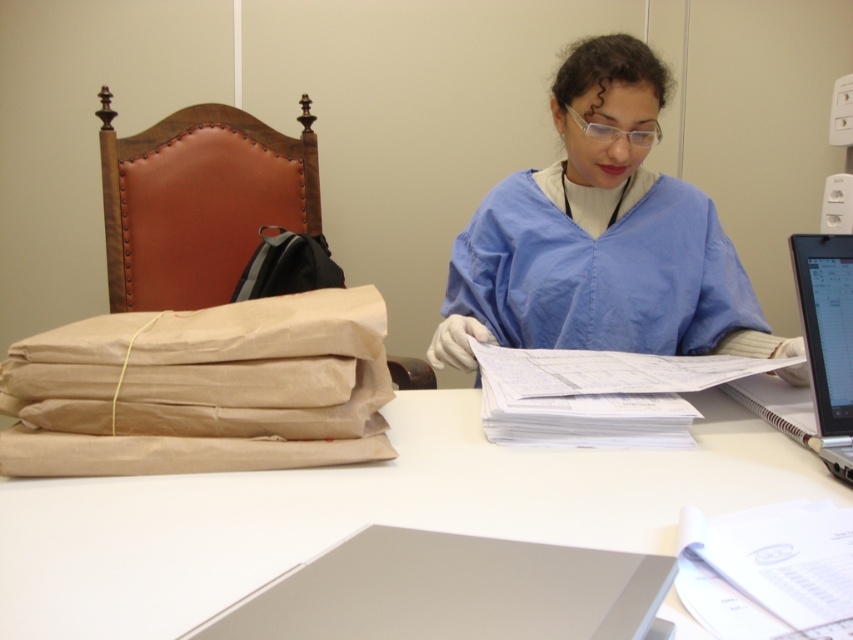
Does blue smooth scrubs at center have a smaller size compared to white paper at center?

Actually, blue smooth scrubs at center might be larger than white paper at center.

At what (x,y) coordinates should I click in order to perform the action: click on blue smooth scrubs at center. Please return your answer as a coordinate pair (x, y). The width and height of the screenshot is (853, 640). Looking at the image, I should click on (601, 236).

Does white matte table at center come behind blue smooth scrubs at center?

No, white matte table at center is in front of blue smooth scrubs at center.

Can you confirm if white matte table at center is positioned to the right of blue smooth scrubs at center?

In fact, white matte table at center is to the left of blue smooth scrubs at center.

Find the location of a particular element. The height and width of the screenshot is (640, 853). white matte table at center is located at coordinates (361, 513).

Can you confirm if blue smooth scrubs at center is wider than silver metallic laptop at right?

Correct, the width of blue smooth scrubs at center exceeds that of silver metallic laptop at right.

Is blue smooth scrubs at center thinner than silver metallic laptop at right?

No.

The height and width of the screenshot is (640, 853). In order to click on blue smooth scrubs at center in this screenshot , I will do `click(601, 236)`.

The width and height of the screenshot is (853, 640). I want to click on blue smooth scrubs at center, so [x=601, y=236].